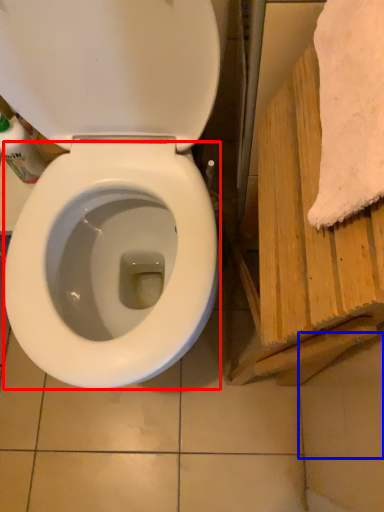
Question: Which of the following is the closest to the observer, bidet (highlighted by a red box) or tile (highlighted by a blue box)?

Choices:
 (A) bidet
 (B) tile

Answer: (A)